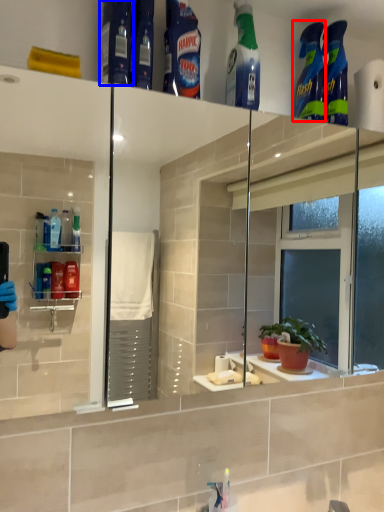
Question: Among these objects, which one is nearest to the camera, cleaning product (highlighted by a red box) or cleaning product (highlighted by a blue box)?

Choices:
 (A) cleaning product
 (B) cleaning product

Answer: (B)